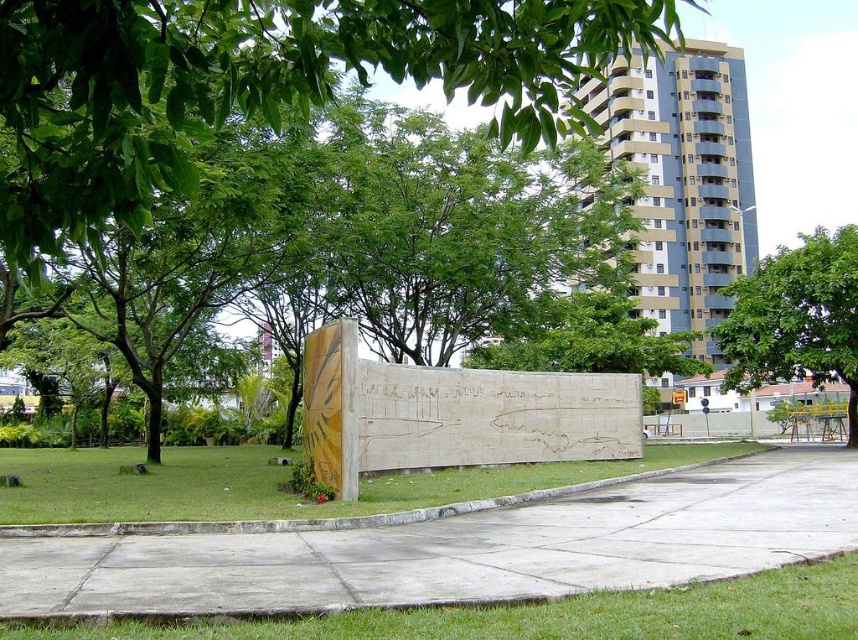
You are planning to set up a picnic blanket in the park. You have two spots to choose from near the sculpture. The first spot is at the green grass at lower center, and the second is at the green grass at lower left. Which spot would you recommend for a more stable and comfortable picnic setup?

The green grass at lower left is thicker than the green grass at lower center, so it would provide a more stable and comfortable picnic setup.

You are standing in the park and want to find a spot to relax under the shade. You see the green leafy tree at upper center and the green grass at lower left. Which direction should you walk to reach the tree first?

You should walk to the left because the green leafy tree at upper center is located to the left of the green grass at lower left, so it will be closer if you move in that direction.